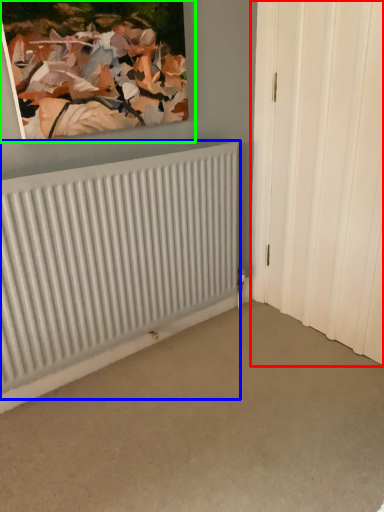
Question: Estimate the real-world distances between objects in this image. Which object is farther from door (highlighted by a red box), radiator (highlighted by a blue box) or picture frame (highlighted by a green box)?

Choices:
 (A) radiator
 (B) picture frame

Answer: (B)